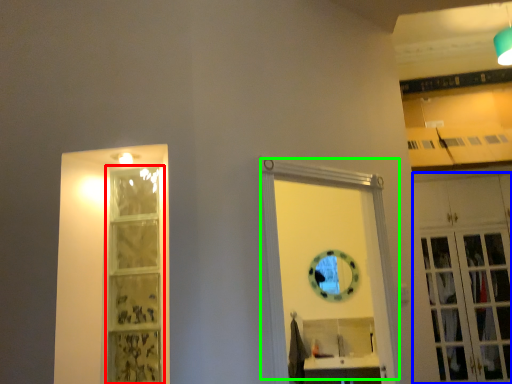
Question: Based on their relative distances, which object is farther from shelf (highlighted by a red box)? Choose from cabinetry (highlighted by a blue box) and door (highlighted by a green box).

Choices:
 (A) cabinetry
 (B) door

Answer: (A)